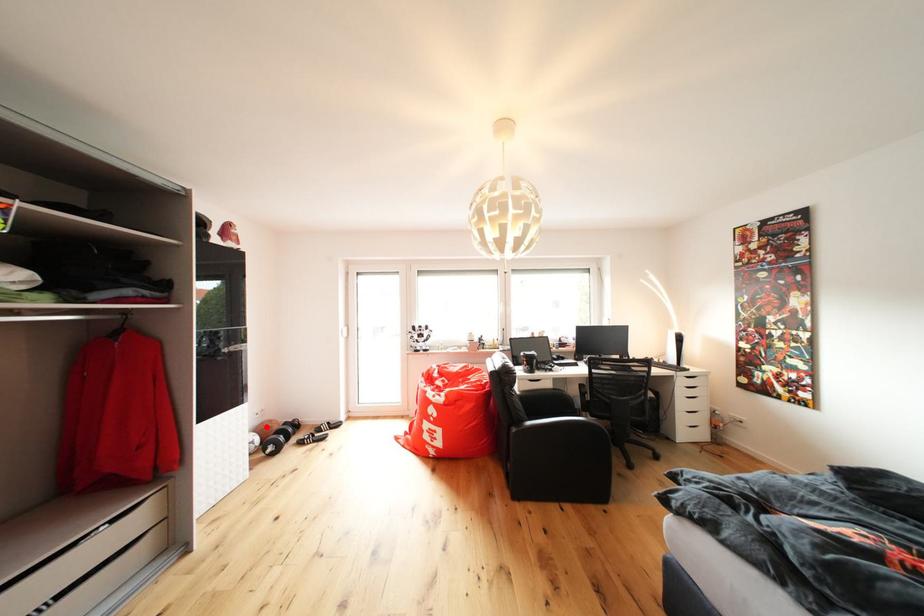
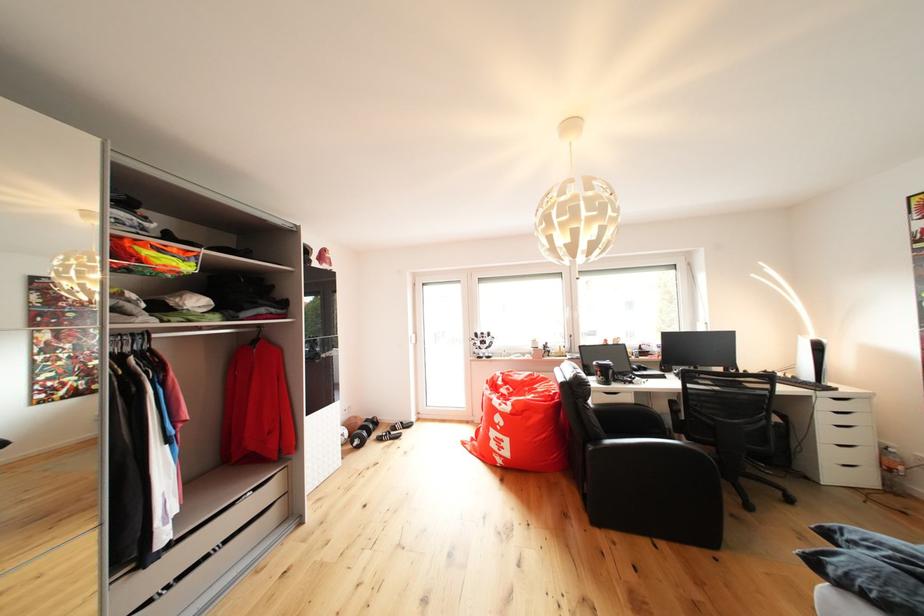
The point at the highlighted location is marked in the first image. Where is the corresponding point in the second image?

(355, 423)